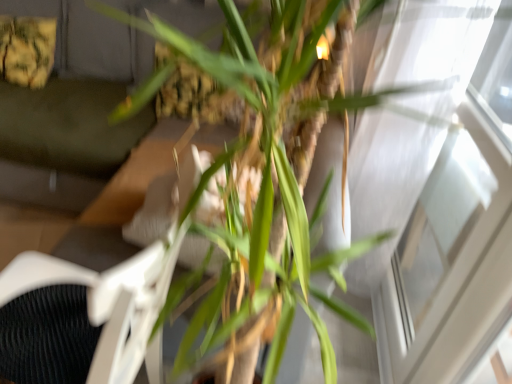
Question: Considering the positions of dark gray fabric couch at upper left and transparent glass window at upper right in the image, is dark gray fabric couch at upper left wider or thinner than transparent glass window at upper right?

Choices:
 (A) wide
 (B) thin

Answer: (A)

Question: From their relative heights in the image, would you say dark gray fabric couch at upper left is taller or shorter than transparent glass window at upper right?

Choices:
 (A) tall
 (B) short

Answer: (B)

Question: Estimate the real-world distances between objects in this image. Which object is closer to the green leafy plant at center?

Choices:
 (A) transparent glass window at upper right
 (B) white textured swivel chair at center
 (C) dark gray fabric couch at upper left

Answer: (B)

Question: Estimate the real-world distances between objects in this image. Which object is closer to the green leafy plant at center?

Choices:
 (A) transparent glass window at upper right
 (B) white textured swivel chair at center
 (C) dark gray fabric couch at upper left

Answer: (B)